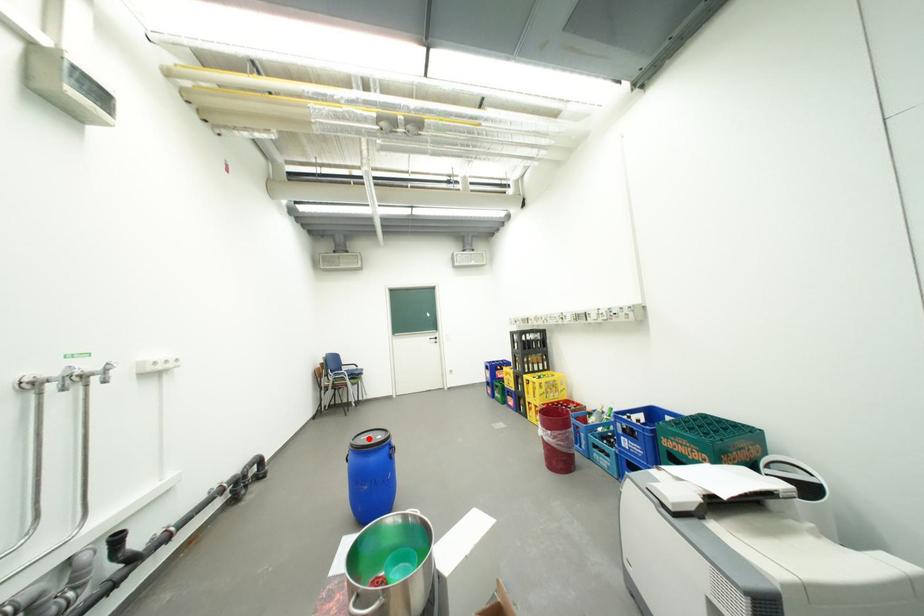
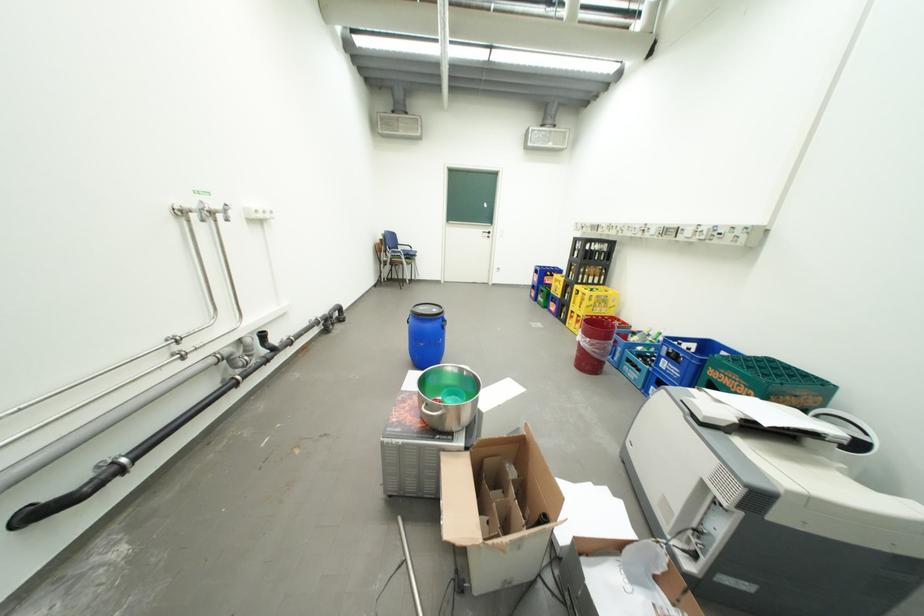
Question: A red point is marked in image1. In image2, is the corresponding 3D point closer to the camera or farther? Reply with the corresponding letter.

Choices:
 (A) The corresponding 3D point is closer.
 (B) The corresponding 3D point is farther.

Answer: (B)